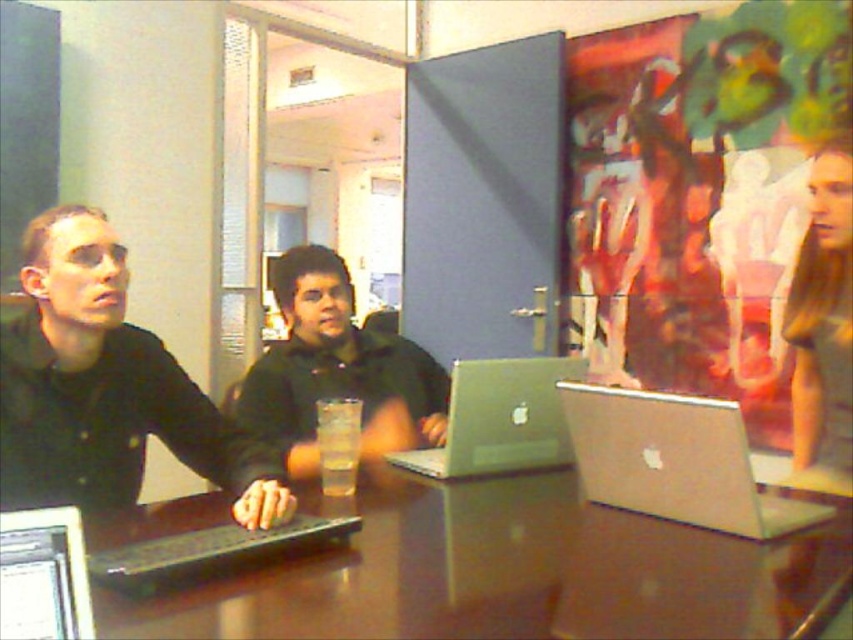
You are a photographer setting up for a group photo. You need to ensure that the matte black shirt at left and the white glossy monitor at lower left are both visible in the frame. Given their widths, which object might require more space in the photo composition?

The matte black shirt at left has a greater width than the white glossy monitor at lower left, so it would require more space in the photo composition.

You are sitting at the table and want to hand a document to the person wearing the matte black shirt at left. To reach them, you need to pass by the white glossy monitor at lower left. Since the monitor is in the way, will you have to move it to the right or to the left to make space?

The matte black shirt at left is positioned on the left side of white glossy monitor at lower left. Therefore, to make space for passing by, you would need to move the white glossy monitor at lower left to the right.

You are a person sitting at the brown glossy table at center. You want to place your silver metallic laptop at center on the table. Will the laptop fit on the table without hanging over the edges?

The brown glossy table at center has a lesser height compared to silver metallic laptop at center. This means the table is shorter in height than the laptop, so placing the laptop on the table would likely cause it to hang over the edges due to the height difference.